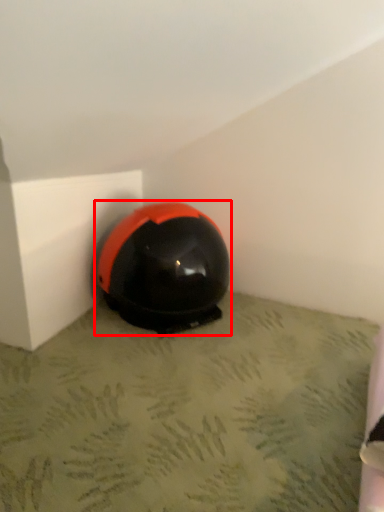
Question: From the image's perspective, considering the relative positions of helmet (annotated by the red box) and concrete in the image provided, where is helmet (annotated by the red box) located with respect to the staircase?

Choices:
 (A) above
 (B) below

Answer: (A)